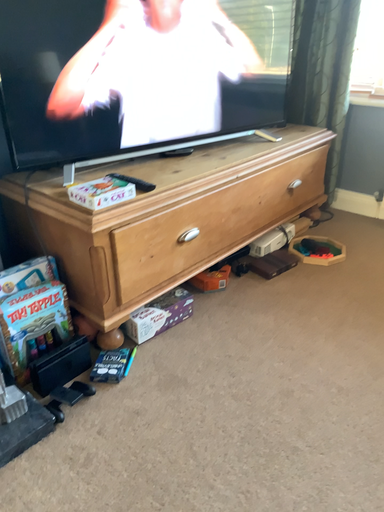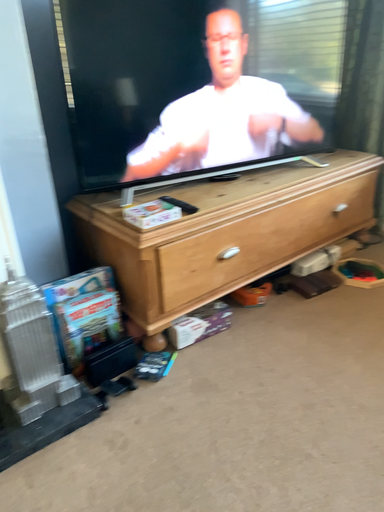
Question: How did the camera likely rotate when shooting the video?

Choices:
 (A) rotated left
 (B) rotated right

Answer: (A)